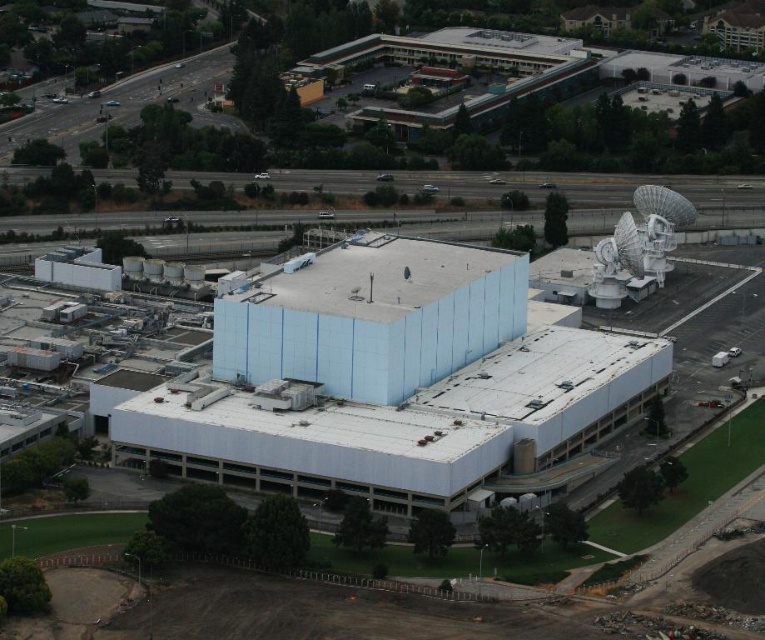
Question: Can you confirm if white matte building at center is smaller than white metallic satellite at upper right?

Choices:
 (A) no
 (B) yes

Answer: (A)

Question: Is white matte building at center above white metallic satellite at upper right?

Choices:
 (A) no
 (B) yes

Answer: (A)

Question: Which object appears closest to the camera in this image?

Choices:
 (A) white matte building at center
 (B) white metallic satellite at upper right

Answer: (A)

Question: Which object appears closest to the camera in this image?

Choices:
 (A) white metallic satellite at upper right
 (B) white matte building at center

Answer: (B)

Question: Does white matte building at center have a larger size compared to white metallic satellite at upper right?

Choices:
 (A) no
 (B) yes

Answer: (B)